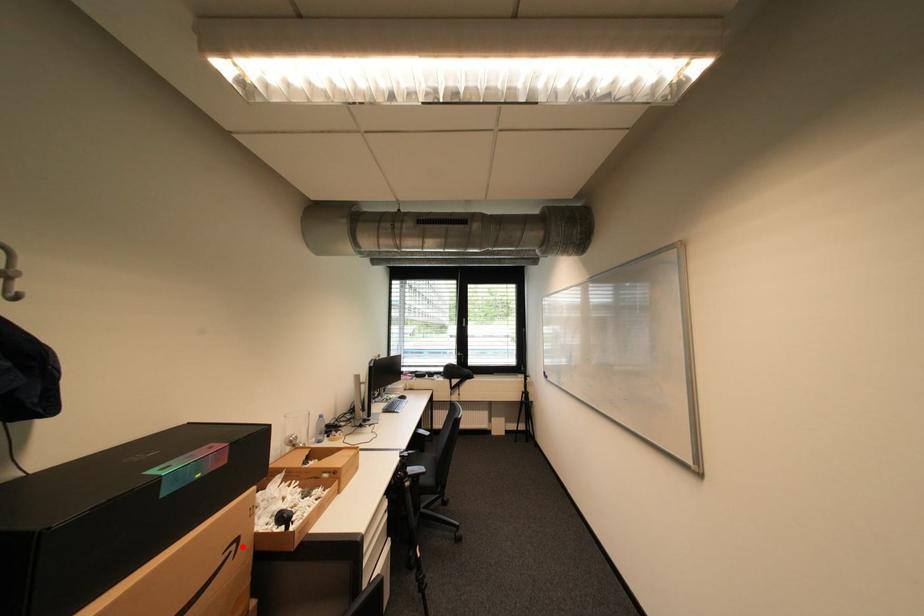
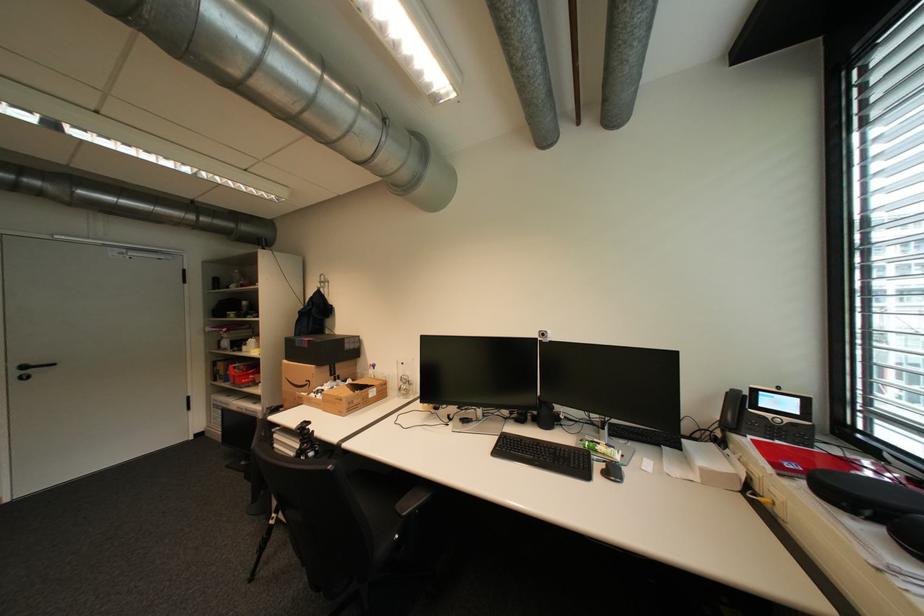
Question: A red point is marked in image1. In image2, is the corresponding 3D point closer to the camera or farther? Reply with the corresponding letter.

Choices:
 (A) The corresponding 3D point is closer.
 (B) The corresponding 3D point is farther.

Answer: (B)